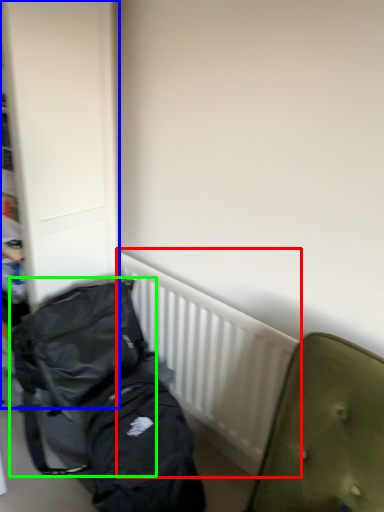
Question: Which object is positioned closest to radiator (highlighted by a red box)? Select from dresser (highlighted by a blue box) and backpack (highlighted by a green box).

Choices:
 (A) dresser
 (B) backpack

Answer: (B)